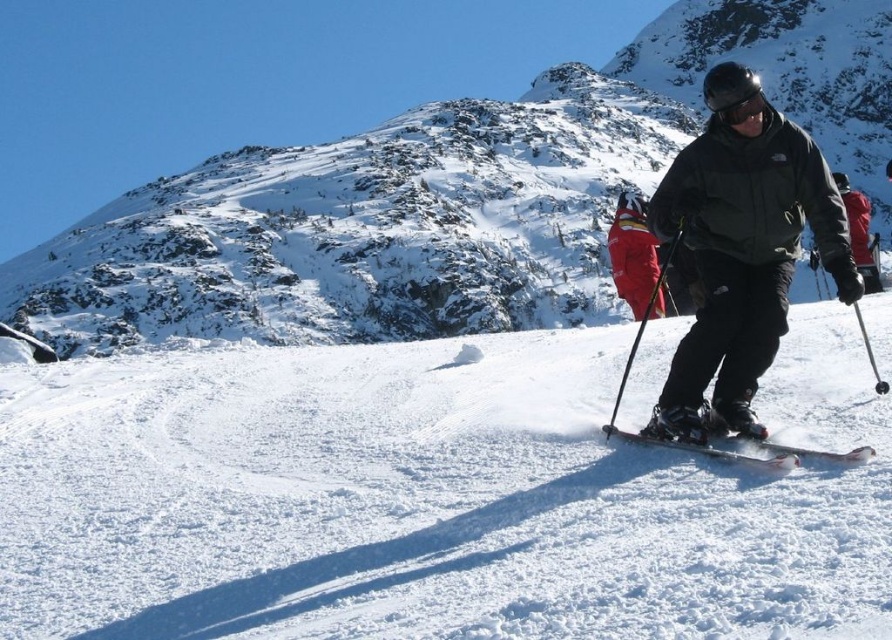
Between white powder snow at center and black plastic ski pole at center, which one is positioned higher?

black plastic ski pole at center is above.

Is white powder snow at center to the right of black plastic ski pole at center from the viewer's perspective?

Incorrect, white powder snow at center is not on the right side of black plastic ski pole at center.

Is point (84, 493) positioned after point (615, 412)?

No, it is in front of (615, 412).

At what (x,y) coordinates should I click in order to perform the action: click on white powder snow at center. Please return your answer as a coordinate pair (x, y). This screenshot has width=892, height=640. Looking at the image, I should click on (431, 497).

Identify the location of snowy rocky mountain at upper center. This screenshot has height=640, width=892. (448, 196).

Locate an element on the screen. This screenshot has width=892, height=640. snowy rocky mountain at upper center is located at coordinates (448, 196).

Between snowy rocky mountain at upper center and black matte goggles at center, which one appears on the right side from the viewer's perspective?

Positioned to the right is snowy rocky mountain at upper center.

Is point (552, 68) positioned after point (748, 93)?

Yes, it is behind point (748, 93).

You are a GUI agent. You are given a task and a screenshot of the screen. Output one action in this format:
    pyautogui.click(x=<x>, y=<y>)
    Task: Click on the snowy rocky mountain at upper center
    The height and width of the screenshot is (640, 892).
    Given the screenshot: What is the action you would take?
    pyautogui.click(x=448, y=196)